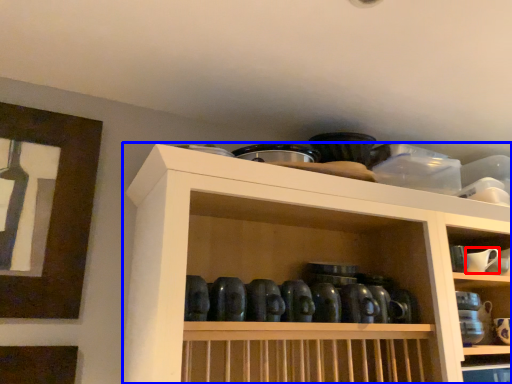
Question: Among these objects, which one is nearest to the camera, tableware (highlighted by a red box) or shelf (highlighted by a blue box)?

Choices:
 (A) tableware
 (B) shelf

Answer: (B)